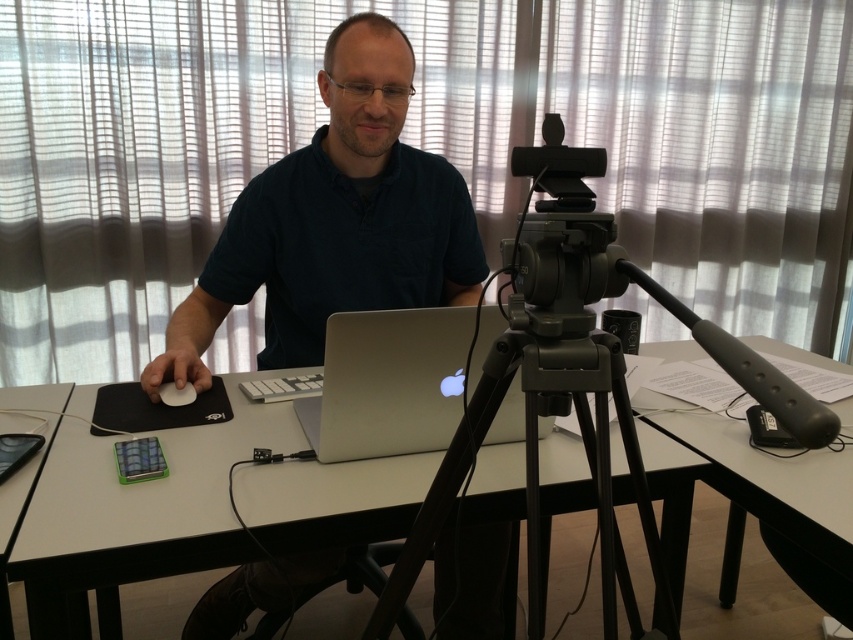
Question: Does white matte table at center appear under white plastic table at right?

Choices:
 (A) yes
 (B) no

Answer: (A)

Question: Which of these objects is positioned farthest from the white plastic table at right?

Choices:
 (A) white matte mouse at center
 (B) black matte tripod at center
 (C) white matte table at center
 (D) matte black shirt at center

Answer: (A)

Question: Does white matte table at center have a lesser width compared to silver metallic laptop at center?

Choices:
 (A) no
 (B) yes

Answer: (A)

Question: Estimate the real-world distances between objects in this image. Which object is closer to the matte black shirt at center?

Choices:
 (A) silver metallic laptop at center
 (B) white matte mouse at center
 (C) black matte tripod at center
 (D) white plastic table at right

Answer: (A)

Question: Is black matte tripod at center closer to the viewer compared to white matte mouse at center?

Choices:
 (A) yes
 (B) no

Answer: (A)

Question: Which point is farther from the camera taking this photo?

Choices:
 (A) (497, 627)
 (B) (850, 401)
 (C) (277, 508)
 (D) (169, 396)

Answer: (A)